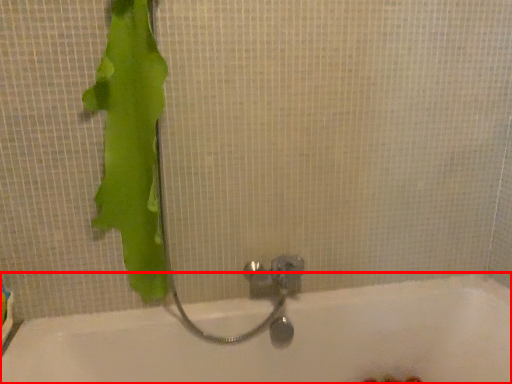
Question: From the image's perspective, what is the correct spatial relationship of bathtub (annotated by the red box) in relation to animal?

Choices:
 (A) below
 (B) above

Answer: (A)